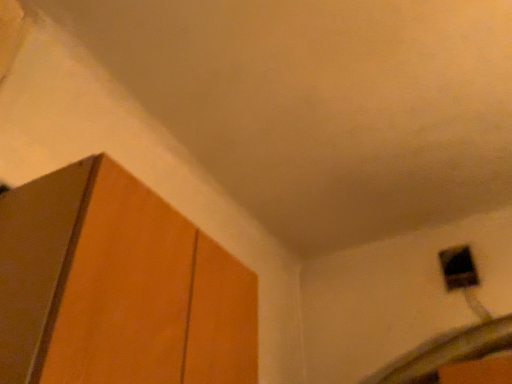
Question: Considering the relative sizes of black matte window at upper right and matte wood cabinet at left in the image provided, is black matte window at upper right shorter than matte wood cabinet at left?

Choices:
 (A) no
 (B) yes

Answer: (B)

Question: Is black matte window at upper right closer to the viewer compared to matte wood cabinet at left?

Choices:
 (A) no
 (B) yes

Answer: (A)

Question: Is black matte window at upper right outside matte wood cabinet at left?

Choices:
 (A) yes
 (B) no

Answer: (A)

Question: Does black matte window at upper right turn towards matte wood cabinet at left?

Choices:
 (A) no
 (B) yes

Answer: (A)

Question: Does black matte window at upper right contain matte wood cabinet at left?

Choices:
 (A) no
 (B) yes

Answer: (A)

Question: From the image's perspective, is black matte window at upper right over matte wood cabinet at left?

Choices:
 (A) yes
 (B) no

Answer: (B)

Question: Can we say matte wood cabinet at left lies outside black matte window at upper right?

Choices:
 (A) no
 (B) yes

Answer: (B)

Question: Does matte wood cabinet at left have a greater width compared to black matte window at upper right?

Choices:
 (A) yes
 (B) no

Answer: (A)

Question: Is matte wood cabinet at left at the left side of black matte window at upper right?

Choices:
 (A) no
 (B) yes

Answer: (B)

Question: Can you confirm if matte wood cabinet at left is taller than black matte window at upper right?

Choices:
 (A) no
 (B) yes

Answer: (B)

Question: Considering the relative sizes of matte wood cabinet at left and black matte window at upper right in the image provided, is matte wood cabinet at left bigger than black matte window at upper right?

Choices:
 (A) yes
 (B) no

Answer: (A)

Question: Does matte wood cabinet at left turn towards black matte window at upper right?

Choices:
 (A) yes
 (B) no

Answer: (B)

Question: Is matte wood cabinet at left wider or thinner than black matte window at upper right?

Choices:
 (A) wide
 (B) thin

Answer: (A)